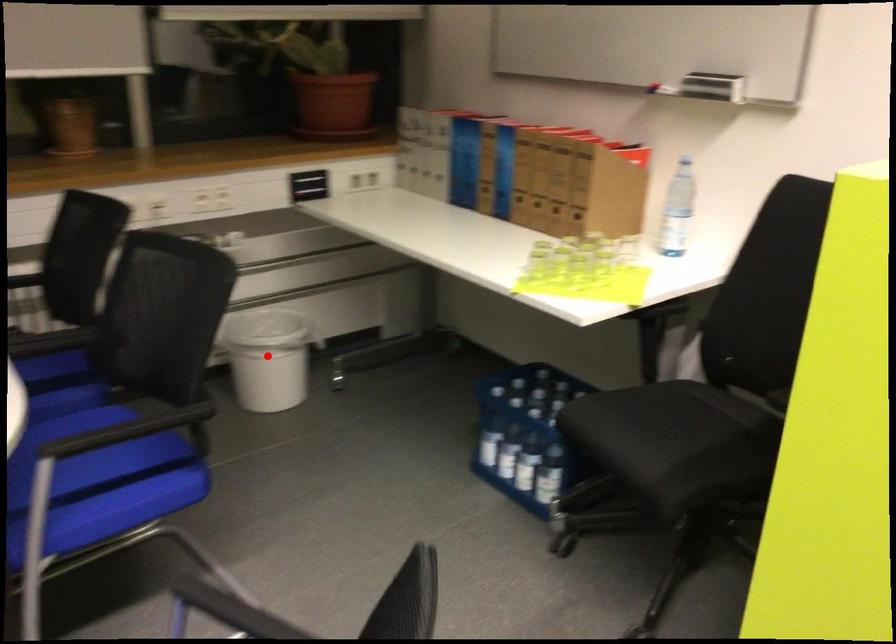
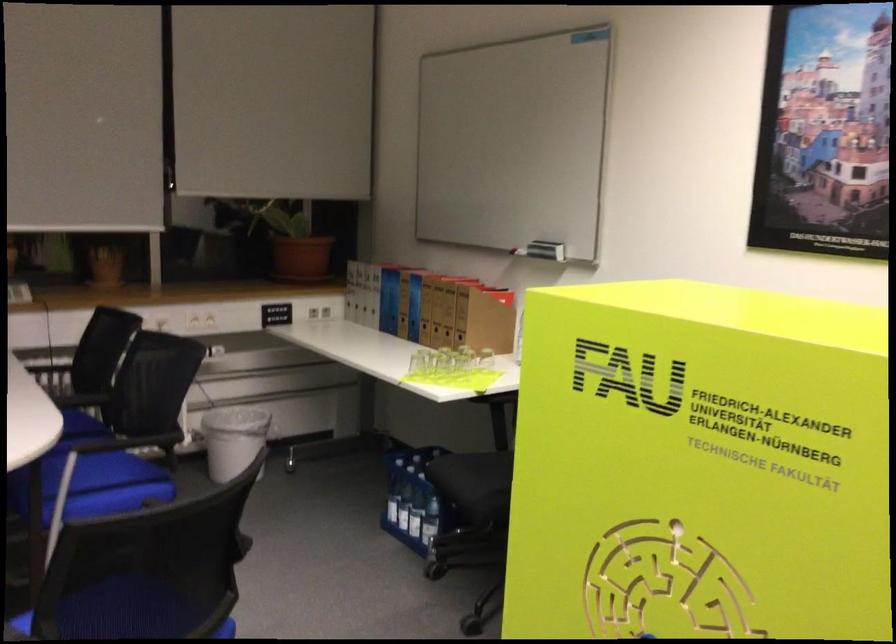
Find the pixel in the second image that matches the highlighted location in the first image.

(234, 440)